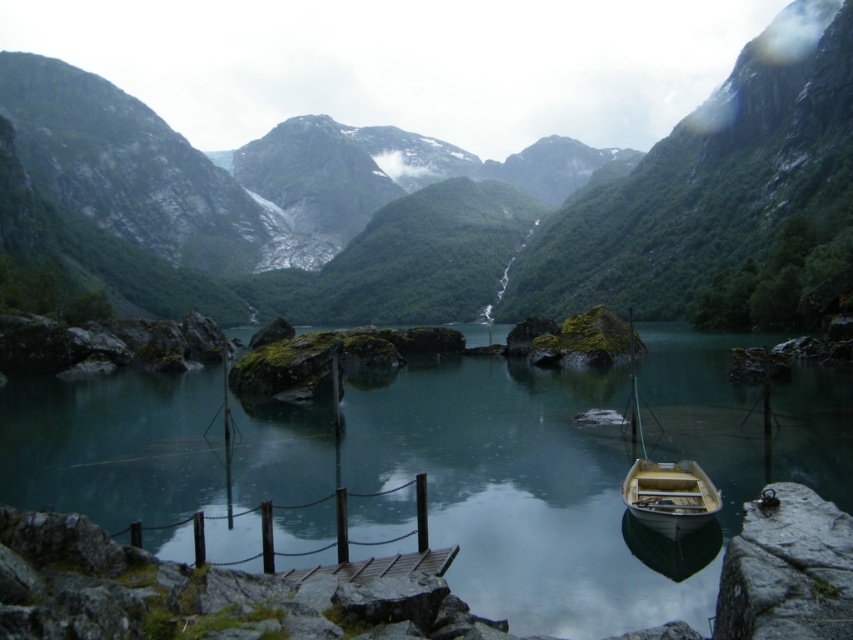
Question: From the image, what is the correct spatial relationship of teal smooth water at center in relation to wooden boat at lower center?

Choices:
 (A) left
 (B) right

Answer: (A)

Question: Which point appears farthest from the camera in this image?

Choices:
 (A) (657, 508)
 (B) (165, 419)

Answer: (B)

Question: From the image, what is the correct spatial relationship of teal smooth water at center in relation to wooden boat at lower center?

Choices:
 (A) left
 (B) right

Answer: (A)

Question: From the image, what is the correct spatial relationship of teal smooth water at center in relation to wooden boat at lower center?

Choices:
 (A) above
 (B) below

Answer: (A)

Question: Which object appears farthest from the camera in this image?

Choices:
 (A) green mossy rock at center
 (B) wooden boat at lower center
 (C) teal smooth water at center

Answer: (A)

Question: Which of these objects is positioned farthest from the wooden boat at lower center?

Choices:
 (A) teal smooth water at center
 (B) green mossy rock at center

Answer: (B)